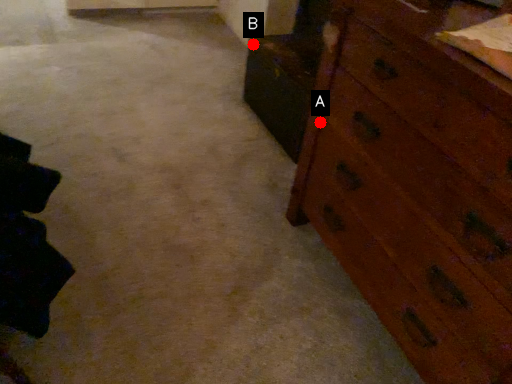
Question: Two points are circled on the image, labeled by A and B beside each circle. Which point is closer to the camera?

Choices:
 (A) A is closer
 (B) B is closer

Answer: (A)